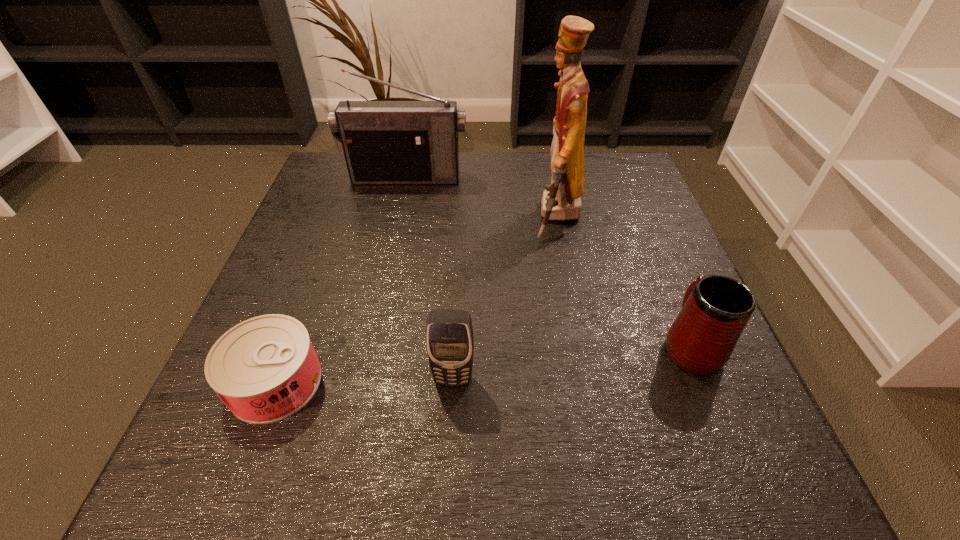
Identify the location of free location located on the front-facing side of the farthest object. The image size is (960, 540). (396, 224).

The width and height of the screenshot is (960, 540). What are the coordinates of `free space located 0.380m on the side of the mug with the handle` in the screenshot? It's located at (628, 193).

Where is `free space located on the side of the mug with the handle`? The height and width of the screenshot is (540, 960). free space located on the side of the mug with the handle is located at coordinates (630, 198).

In order to click on vacant space situated 0.060m on the side of the mug with the handle in this screenshot , I will do `click(668, 290)`.

Where is `vacant space located 0.080m on the right of the shortest object`? The image size is (960, 540). vacant space located 0.080m on the right of the shortest object is located at coordinates (372, 382).

Where is `nutcracker present at the far edge`? The image size is (960, 540). nutcracker present at the far edge is located at coordinates (561, 200).

Image resolution: width=960 pixels, height=540 pixels. Find the location of `radio receiver that is at the far edge`. radio receiver that is at the far edge is located at coordinates (384, 142).

This screenshot has height=540, width=960. Find the location of `radio receiver that is at the left edge`. radio receiver that is at the left edge is located at coordinates (384, 142).

Locate an element on the screen. can that is at the left edge is located at coordinates (264, 369).

Locate an element on the screen. This screenshot has width=960, height=540. object situated at the right edge is located at coordinates (715, 310).